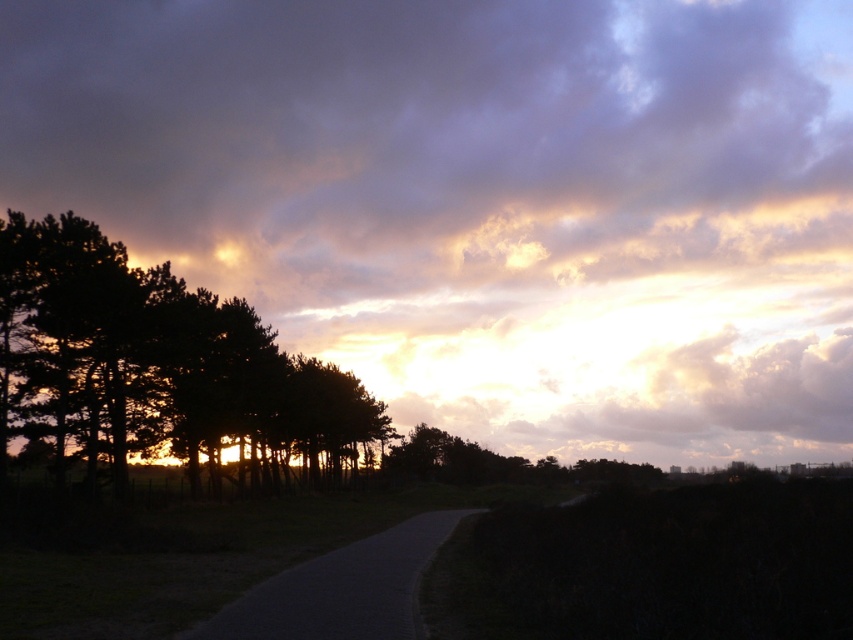
Between dark green foliage at left and dark asphalt road at center, which one is positioned higher?

dark green foliage at left

Where is `dark green foliage at left`? The height and width of the screenshot is (640, 853). dark green foliage at left is located at coordinates click(152, 362).

The image size is (853, 640). What are the coordinates of `cloudy sky at upper center` in the screenshot? It's located at (482, 200).

Between cloudy sky at upper center and dark green foliage at left, which one is positioned lower?

Positioned lower is dark green foliage at left.

Does point (805, 243) lie behind point (53, 396)?

Yes, point (805, 243) is farther from viewer.

Find the location of a particular element. cloudy sky at upper center is located at coordinates (482, 200).

Does cloudy sky at upper center have a smaller size compared to dark asphalt road at center?

No, cloudy sky at upper center is not smaller than dark asphalt road at center.

Does cloudy sky at upper center appear on the left side of dark asphalt road at center?

Incorrect, cloudy sky at upper center is not on the left side of dark asphalt road at center.

What do you see at coordinates (482, 200) in the screenshot? I see `cloudy sky at upper center` at bounding box center [482, 200].

The image size is (853, 640). In order to click on cloudy sky at upper center in this screenshot , I will do `click(482, 200)`.